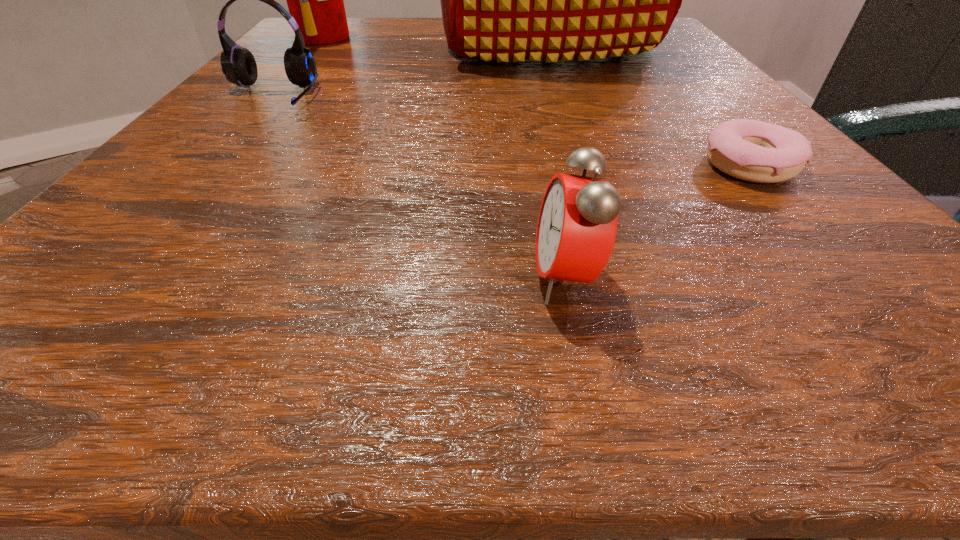
Locate an element on the screen. Image resolution: width=960 pixels, height=540 pixels. free spot located on the front-facing side of the second shortest object is located at coordinates (456, 279).

The width and height of the screenshot is (960, 540). I want to click on free space located on the front-facing side of the second shortest object, so click(445, 279).

At what (x,y) coordinates should I click in order to perform the action: click on blank area located 0.070m on the front-facing side of the second shortest object. Please return your answer as a coordinate pair (x, y). Looking at the image, I should click on pos(456,279).

Locate an element on the screen. The image size is (960, 540). vacant space situated on the back of the doughnut is located at coordinates (681, 86).

Locate an element on the screen. The image size is (960, 540). backpack present at the far edge is located at coordinates (502, 0).

The image size is (960, 540). In order to click on fire extinguisher situated at the far edge in this screenshot , I will do (x=315, y=0).

Identify the location of object situated at the near edge. The image size is (960, 540). (577, 225).

This screenshot has width=960, height=540. Identify the location of fire extinguisher at the left edge. (315, 0).

This screenshot has height=540, width=960. What are the coordinates of `headset at the left edge` in the screenshot? It's located at (238, 64).

This screenshot has width=960, height=540. In order to click on backpack situated at the right edge in this screenshot , I will do `click(502, 0)`.